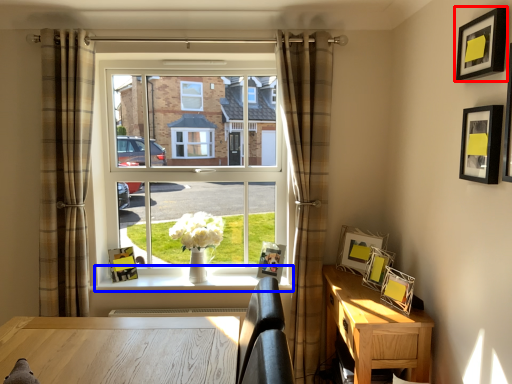
Question: Which of the following is the farthest to the observer, picture frame (highlighted by a red box) or window sill (highlighted by a blue box)?

Choices:
 (A) picture frame
 (B) window sill

Answer: (B)